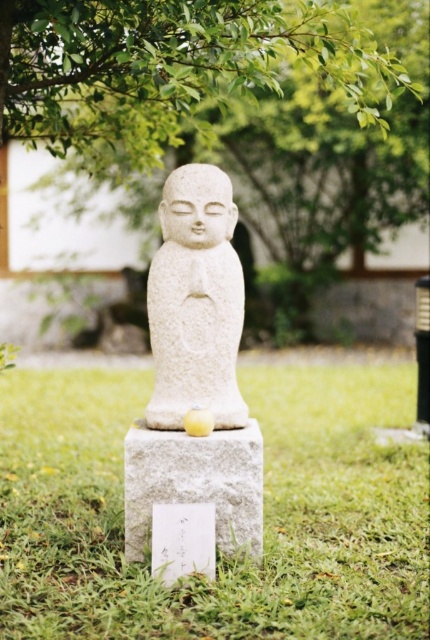
You are standing in the serene outdoor setting with the small stone statue. You notice a point marked at coordinates (218, 557). What is located at that point?

The point at coordinates (218, 557) has green grass at center.

You are standing in the outdoor area looking at the scene. Which object is closer to you between the green grass at center and the green leafy tree at upper center?

The green grass at center is closer to you because it is in front of the green leafy tree at upper center.

You are a gardener who wants to plant a new flowerbed between the green grass at center and the green leafy tree at upper center. Based on their heights, which one should you place the flowerbed closer to?

The green grass at center is taller than the green leafy tree at upper center, so you should place the flowerbed closer to the green leafy tree at upper center to ensure proper sunlight and airflow.